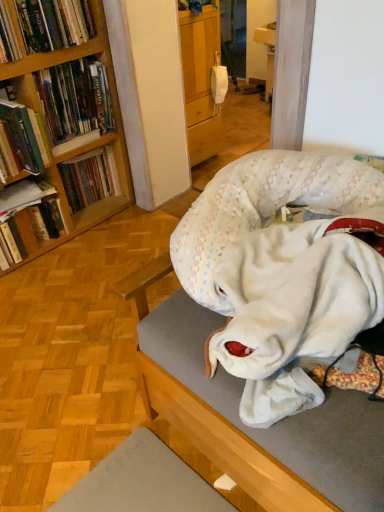
Question: Is hardcover book at left, which is counted as the 4th book, starting from the bottom, in front of or behind hardcover book at left, which is the 2th book in bottom-to-top order, in the image?

Choices:
 (A) behind
 (B) front

Answer: (B)

Question: Looking at the image, does hardcover book at left, which is counted as the third book, starting from the top, seem bigger or smaller compared to hardcover book at left, the fifth book when ordered from top to bottom?

Choices:
 (A) big
 (B) small

Answer: (A)

Question: Estimate the real-world distances between objects in this image. Which object is farther from the hardcover book at left, which is counted as the third book, starting from the bottom?

Choices:
 (A) hardcover books at left, acting as the fifth book starting from the bottom
 (B) hardcover book at left, which is the 2th book in bottom-to-top order
 (C) hardcover book at left, which ranks as the 1th book in bottom-to-top order
 (D) hardcover book at left, which is counted as the third book, starting from the top
 (E) hardcover book at upper left, acting as the 6th book starting from the bottom

Answer: (E)

Question: Considering the real-world distances, which object is closest to the hardcover books at left, the second book when ordered from top to bottom?

Choices:
 (A) hardcover book at left, the 6th book positioned from the top
 (B) white plush dog bed at center
 (C) hardcover book at left, which is the 2th book in bottom-to-top order
 (D) hardcover book at upper left, acting as the 6th book starting from the bottom
 (E) hardcover book at left, which is counted as the third book, starting from the bottom

Answer: (D)